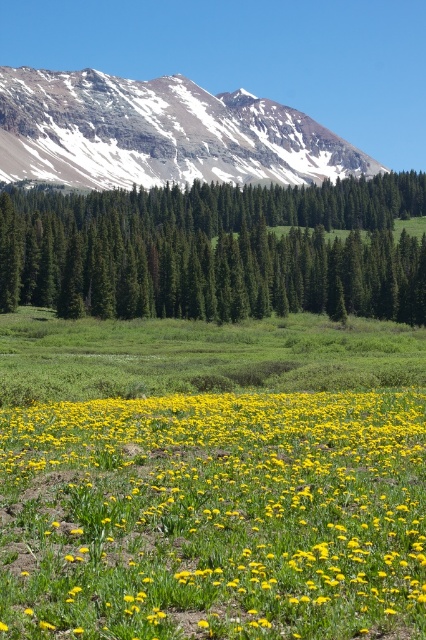
You are a hiker planning to take a photo of the green matte tree at center and the snowy rocky mountain at upper left. Which object will appear narrower in your photo?

The green matte tree at center will appear narrower in the photo because its width is less than that of the snowy rocky mountain at upper left.

You are standing at the point with coordinates point (213, 516). Looking around, you see a yellow matte flower at center. What is the nearest object to you?

The nearest object to you is the yellow matte flower at center because you are standing exactly at its coordinates.